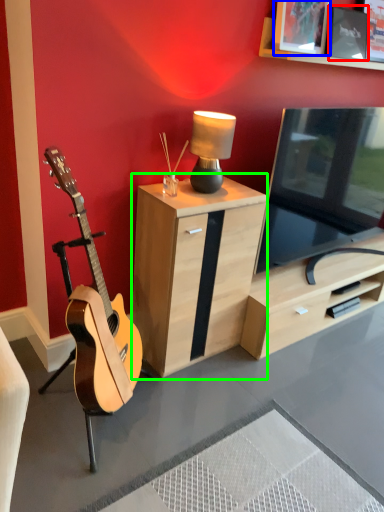
Question: Which object is the closest to the picture frame (highlighted by a red box)? Choose among these: picture frame (highlighted by a blue box) or cabinetry (highlighted by a green box).

Choices:
 (A) picture frame
 (B) cabinetry

Answer: (A)